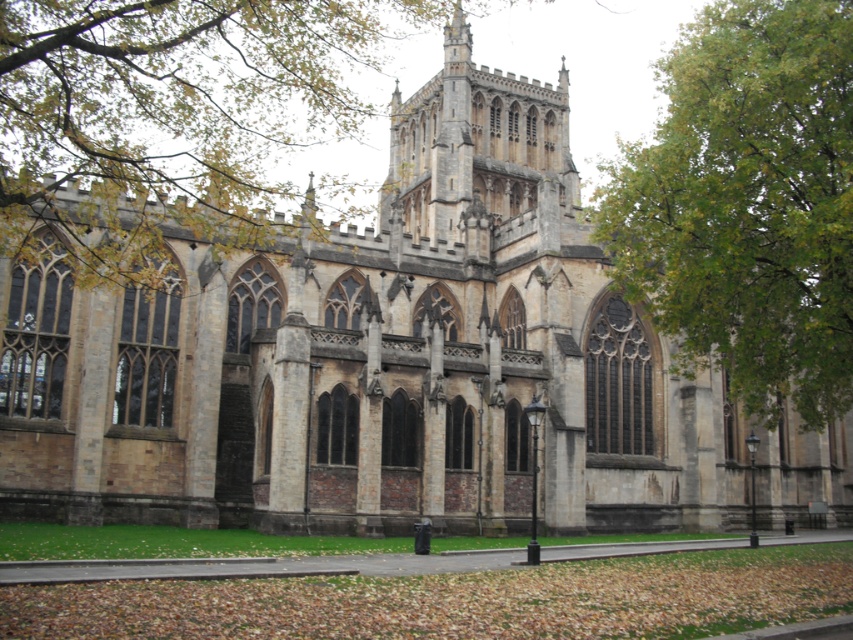
Is green leafy tree at upper center shorter than green leafy tree at upper right?

Yes, green leafy tree at upper center is shorter than green leafy tree at upper right.

Which is more to the right, green leafy tree at upper center or green leafy tree at upper right?

From the viewer's perspective, green leafy tree at upper right appears more on the right side.

The image size is (853, 640). What do you see at coordinates (167, 116) in the screenshot? I see `green leafy tree at upper center` at bounding box center [167, 116].

At what (x,y) coordinates should I click in order to perform the action: click on green leafy tree at upper center. Please return your answer as a coordinate pair (x, y). Looking at the image, I should click on (167, 116).